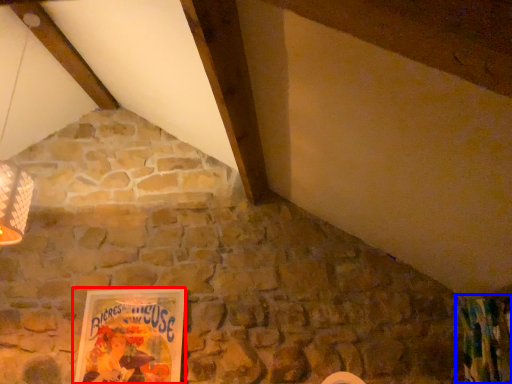
Question: Which point is closer to the camera, picture frame (highlighted by a red box) or curtain (highlighted by a blue box)?

Choices:
 (A) picture frame
 (B) curtain

Answer: (B)